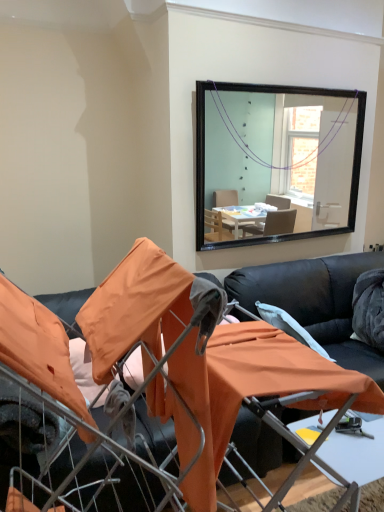
Question: Is there a large distance between black leather couch at center and black leather couch at center?

Choices:
 (A) no
 (B) yes

Answer: (B)

Question: Can you confirm if black leather couch at center is wider than black leather couch at center?

Choices:
 (A) no
 (B) yes

Answer: (A)

Question: Could you tell me if black leather couch at center is facing black leather couch at center?

Choices:
 (A) yes
 (B) no

Answer: (B)

Question: Is black leather couch at center further to camera compared to black leather couch at center?

Choices:
 (A) yes
 (B) no

Answer: (B)

Question: From the image's perspective, is black leather couch at center located beneath black leather couch at center?

Choices:
 (A) no
 (B) yes

Answer: (B)

Question: Is black leather couch at center to the right of black leather couch at center from the viewer's perspective?

Choices:
 (A) no
 (B) yes

Answer: (A)

Question: Is black leather couch at center in contact with black leather couch at center?

Choices:
 (A) no
 (B) yes

Answer: (A)

Question: Is black leather couch at center at the left side of black leather couch at center?

Choices:
 (A) no
 (B) yes

Answer: (A)

Question: From the image's perspective, would you say black leather couch at center is shown under black leather couch at center?

Choices:
 (A) yes
 (B) no

Answer: (B)

Question: Is black leather couch at center wider than black leather couch at center?

Choices:
 (A) yes
 (B) no

Answer: (A)

Question: Is black leather couch at center taller than black leather couch at center?

Choices:
 (A) yes
 (B) no

Answer: (B)

Question: From a real-world perspective, is black leather couch at center over black leather couch at center?

Choices:
 (A) yes
 (B) no

Answer: (B)

Question: Considering the relative positions of black leather couch at center and white plastic table at lower center in the image provided, is black leather couch at center behind white plastic table at lower center?

Choices:
 (A) yes
 (B) no

Answer: (A)